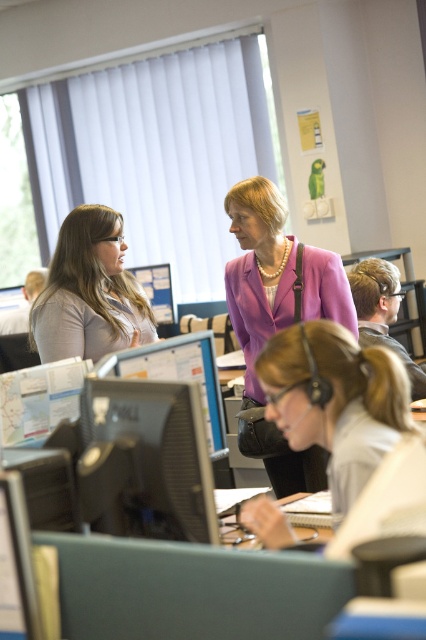
You are an office worker who needs to access a file on the black glossy monitor at center. However, you notice another matte black monitor at center in the same area. Which monitor should you interact with to access the file?

You should interact with the black glossy monitor at center because it is in front of the matte black monitor at center, making it more accessible.

You are an office manager observing the scene. You need to identify which object is larger between the light brown hair at center and the matte gray shirt at left. Can you determine this based on the spatial information provided?

The light brown hair at center is bigger than the matte gray shirt at left according to the spatial information provided.